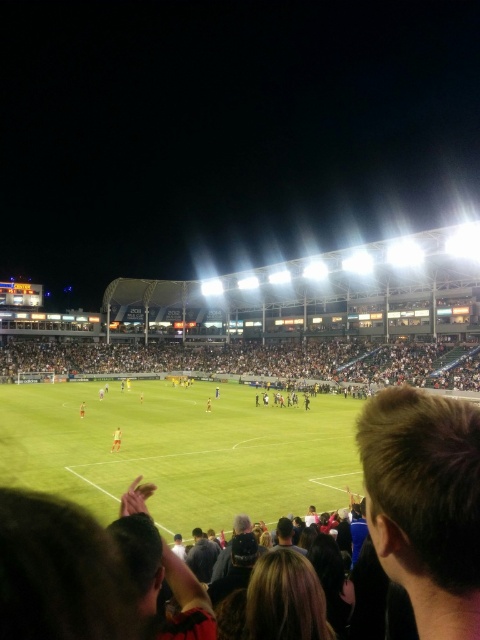
You are a photographer standing at the edge of the soccer field. You want to capture a photo of the dark gray crowd at center from your current position. Considering the distance between you and the crowd, is this feasible with a standard camera lens that has a maximum focal length of 200mm?

The dark gray crowd at center and viewer are 264.51 feet apart. A standard camera lens with a maximum focal length of 200mm may struggle to capture a clear, detailed image of the crowd from this distance. A longer telephoto lens would be more appropriate for such a shot.

You are a photographer at the soccer match and want to take a photo that includes both the dark gray crowd at center and the orange fabric person at center. Which object should you focus on first to ensure both are in the frame?

You should focus on the dark gray crowd at center first because it is larger in size than the orange fabric person at center, so it will require more space in the composition.